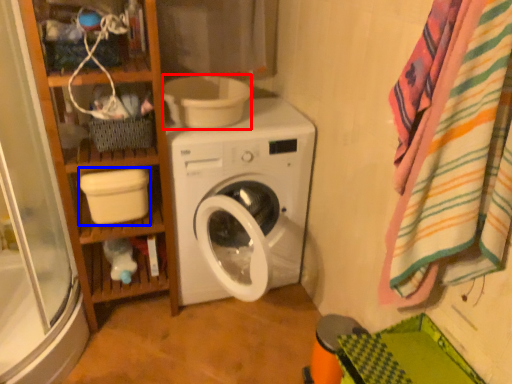
Question: Which object is further to the camera taking this photo, toilet bowl (highlighted by a red box) or toilet bowl (highlighted by a blue box)?

Choices:
 (A) toilet bowl
 (B) toilet bowl

Answer: (A)